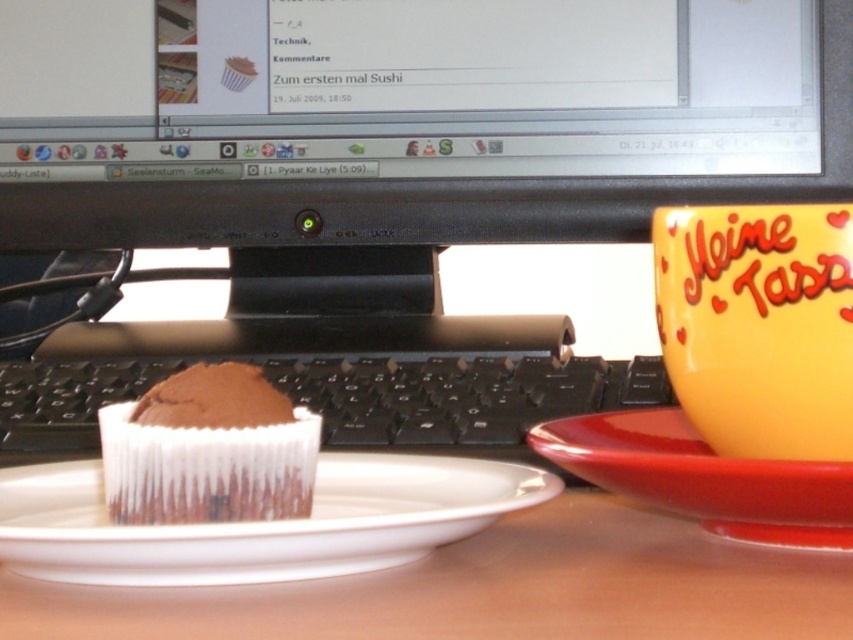
In the scene shown: Does matte white plate at center lie in front of white glossy plate at center?

That is True.

Locate an element on the screen. This screenshot has height=640, width=853. matte white plate at center is located at coordinates (491, 588).

Does matte black monitor at center appear over black plastic keyboard at center?

Indeed, matte black monitor at center is positioned over black plastic keyboard at center.

Does matte black monitor at center have a larger size compared to black plastic keyboard at center?

Correct, matte black monitor at center is larger in size than black plastic keyboard at center.

Is point (693, 131) closer to viewer compared to point (128, 380)?

No.

The width and height of the screenshot is (853, 640). Find the location of `matte black monitor at center`. matte black monitor at center is located at coordinates (418, 120).

Is matte white plate at center below black plastic keyboard at center?

Yes, matte white plate at center is below black plastic keyboard at center.

Image resolution: width=853 pixels, height=640 pixels. What do you see at coordinates (491, 588) in the screenshot? I see `matte white plate at center` at bounding box center [491, 588].

Find the location of a particular element. The width and height of the screenshot is (853, 640). matte white plate at center is located at coordinates [491, 588].